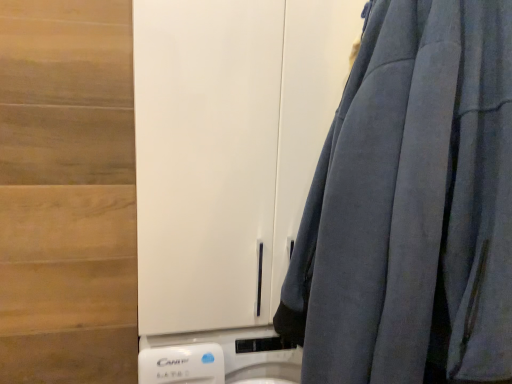
Locate an element on the screen. Image resolution: width=512 pixels, height=384 pixels. white matte cabinet at center is located at coordinates (206, 160).

What do you see at coordinates (206, 160) in the screenshot?
I see `white matte cabinet at center` at bounding box center [206, 160].

The image size is (512, 384). What do you see at coordinates (412, 206) in the screenshot?
I see `velvet blue curtain at right` at bounding box center [412, 206].

I want to click on velvet blue curtain at right, so click(412, 206).

This screenshot has height=384, width=512. Identify the location of white matte cabinet at center. point(206,160).

Between white matte cabinet at center and velvet blue curtain at right, which one appears on the right side from the viewer's perspective?

Positioned to the right is velvet blue curtain at right.

Considering the positions of objects white matte cabinet at center and velvet blue curtain at right in the image provided, who is in front, white matte cabinet at center or velvet blue curtain at right?

velvet blue curtain at right.

Is point (269, 50) in front of point (507, 314)?

No, it is behind (507, 314).

From the image's perspective, who appears lower, white matte cabinet at center or velvet blue curtain at right?

velvet blue curtain at right.

From a real-world perspective, between white matte cabinet at center and velvet blue curtain at right, who is vertically higher?

From a 3D spatial view, white matte cabinet at center is above.

Considering the sizes of objects white matte cabinet at center and velvet blue curtain at right in the image provided, who is thinner, white matte cabinet at center or velvet blue curtain at right?

With smaller width is velvet blue curtain at right.

Which of these two, white matte cabinet at center or velvet blue curtain at right, stands shorter?

white matte cabinet at center is shorter.

Considering the relative sizes of white matte cabinet at center and velvet blue curtain at right in the image provided, is white matte cabinet at center smaller than velvet blue curtain at right?

No, white matte cabinet at center is not smaller than velvet blue curtain at right.

Can we say white matte cabinet at center lies outside velvet blue curtain at right?

Absolutely, white matte cabinet at center is external to velvet blue curtain at right.

Is there a large distance between white matte cabinet at center and velvet blue curtain at right?

No, there isn't a large distance between white matte cabinet at center and velvet blue curtain at right.

Is white matte cabinet at center turned away from velvet blue curtain at right?

No, white matte cabinet at center's orientation is not away from velvet blue curtain at right.

Find the location of a particular element. The height and width of the screenshot is (384, 512). barn door behind the velvet blue curtain at right is located at coordinates tap(206, 160).

Between velvet blue curtain at right and white matte cabinet at center, which one appears on the right side from the viewer's perspective?

From the viewer's perspective, velvet blue curtain at right appears more on the right side.

Looking at this image, is velvet blue curtain at right closer to camera compared to white matte cabinet at center?

That is True.

Considering the positions of point (399, 87) and point (157, 37), is point (399, 87) closer or farther from the camera than point (157, 37)?

Clearly, point (399, 87) is closer to the camera than point (157, 37).

From the image's perspective, between velvet blue curtain at right and white matte cabinet at center, who is located below?

From the image's view, velvet blue curtain at right is below.

From a real-world perspective, is velvet blue curtain at right physically below white matte cabinet at center?

Yes, from a real-world perspective, velvet blue curtain at right is beneath white matte cabinet at center.

Between velvet blue curtain at right and white matte cabinet at center, which one has smaller width?

With smaller width is velvet blue curtain at right.

In terms of height, does velvet blue curtain at right look taller or shorter compared to white matte cabinet at center?

Considering their sizes, velvet blue curtain at right has more height than white matte cabinet at center.

Who is smaller, velvet blue curtain at right or white matte cabinet at center?

With smaller size is velvet blue curtain at right.

Is velvet blue curtain at right completely or partially outside of white matte cabinet at center?

That's correct, velvet blue curtain at right is outside of white matte cabinet at center.

Would you consider velvet blue curtain at right to be distant from white matte cabinet at center?

velvet blue curtain at right is actually quite close to white matte cabinet at center.

Is white matte cabinet at center at the back of velvet blue curtain at right?

No.

How many degrees apart are the facing directions of velvet blue curtain at right and white matte cabinet at center?

The angle between the facing direction of velvet blue curtain at right and the facing direction of white matte cabinet at center is 91.1 degrees.

Find the location of a particular element. barn door on the left of velvet blue curtain at right is located at coordinates (206, 160).

The width and height of the screenshot is (512, 384). I want to click on barn door behind the velvet blue curtain at right, so click(x=206, y=160).

Where is `curtain located in front of the white matte cabinet at center`? Image resolution: width=512 pixels, height=384 pixels. curtain located in front of the white matte cabinet at center is located at coordinates (412, 206).